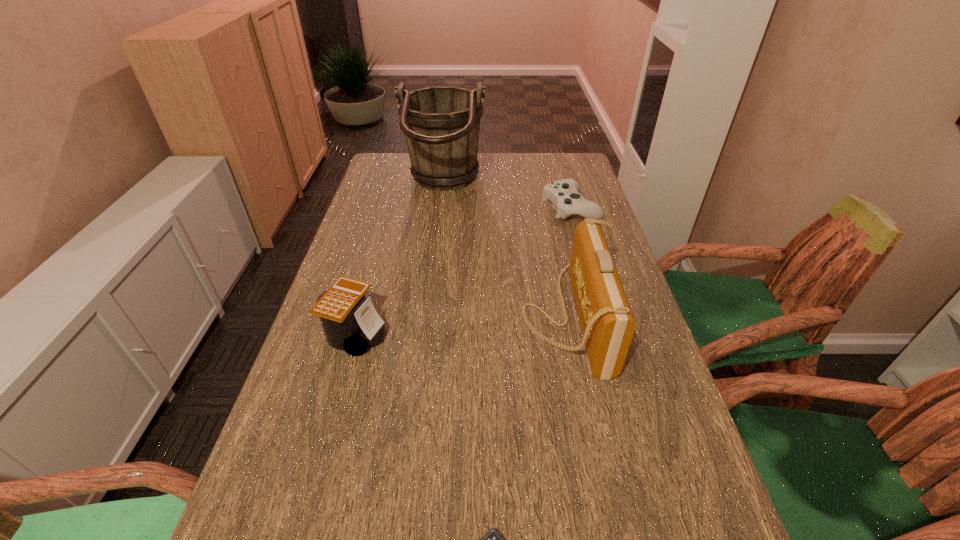
This screenshot has height=540, width=960. I want to click on free space between the left calculator and the second shortest object, so click(463, 270).

Find the location of a particular element. The image size is (960, 540). free space that is in between the tallest object and the taller calculator is located at coordinates (399, 259).

The height and width of the screenshot is (540, 960). Find the location of `free space between the taller calculator and the fourth tallest object`. free space between the taller calculator and the fourth tallest object is located at coordinates (463, 270).

Image resolution: width=960 pixels, height=540 pixels. Find the location of `free area in between the second tallest object and the control`. free area in between the second tallest object and the control is located at coordinates (569, 262).

This screenshot has width=960, height=540. Find the location of `vacant region between the bucket and the second tallest object`. vacant region between the bucket and the second tallest object is located at coordinates (506, 251).

The height and width of the screenshot is (540, 960). Identify the location of free area in between the farther calculator and the handbag. (462, 325).

At what (x,y) coordinates should I click in order to perform the action: click on free area in between the handbag and the bucket. Please return your answer as a coordinate pair (x, y). The width and height of the screenshot is (960, 540). Looking at the image, I should click on [506, 251].

You are a GUI agent. You are given a task and a screenshot of the screen. Output one action in this format:
    pyautogui.click(x=<x>, y=<y>)
    Task: Click on the object that is the second closest to the handbag
    The image size is (960, 540).
    Given the screenshot: What is the action you would take?
    pyautogui.click(x=441, y=124)

The height and width of the screenshot is (540, 960). What are the coordinates of `object that ranks as the fourth closest to the taller calculator` in the screenshot? It's located at (564, 195).

Find the location of a particular element. free location that satisfies the following two spatial constraints: 1. on the front side of the control; 2. on the decorative side of the fourth shortest object is located at coordinates (602, 317).